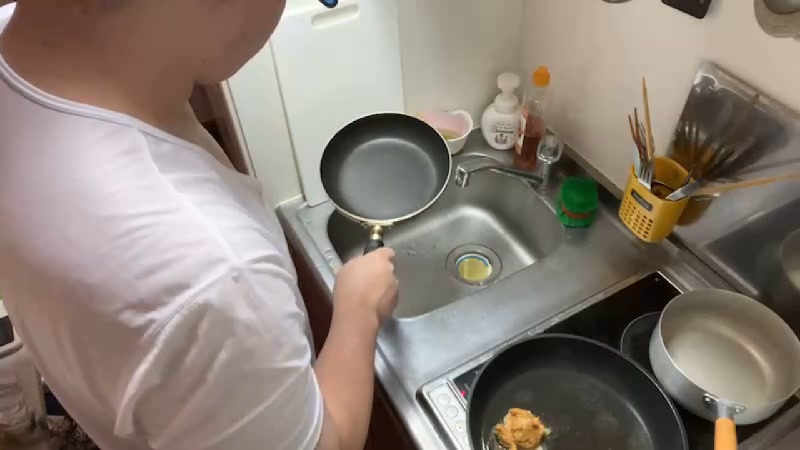
In order to click on soap in this screenshot , I will do `click(488, 119)`.